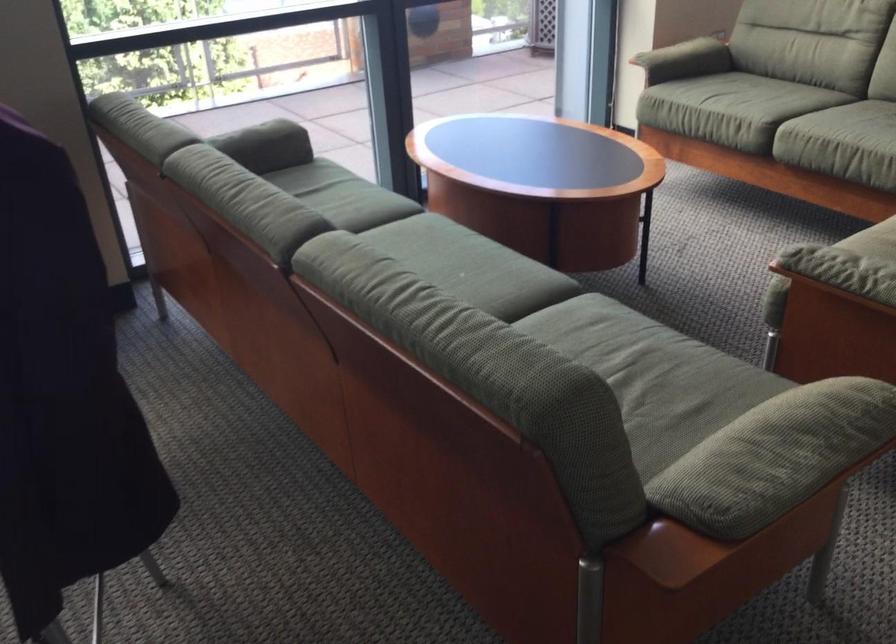
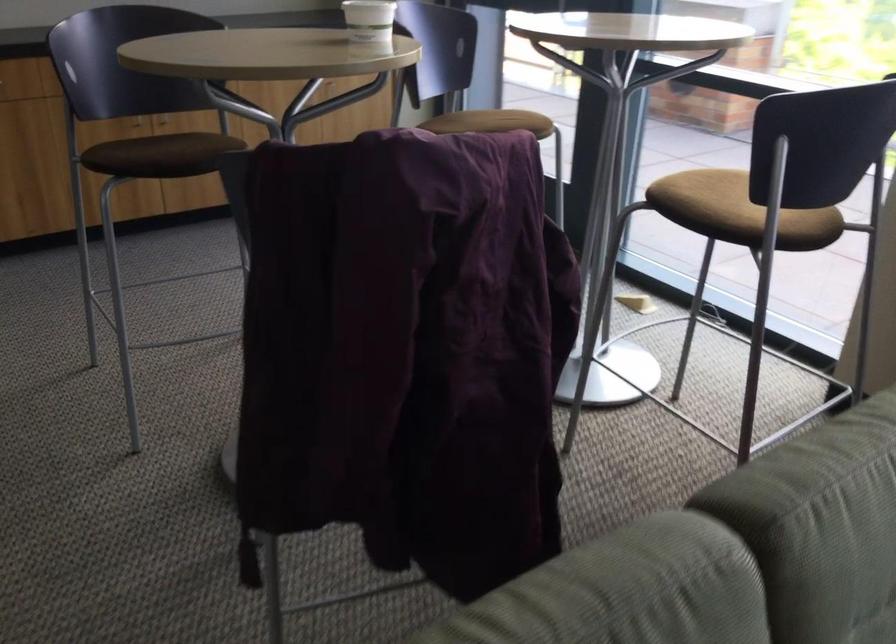
Locate, in the second image, the point that corresponds to pixel 369 245 in the first image.

(668, 585)